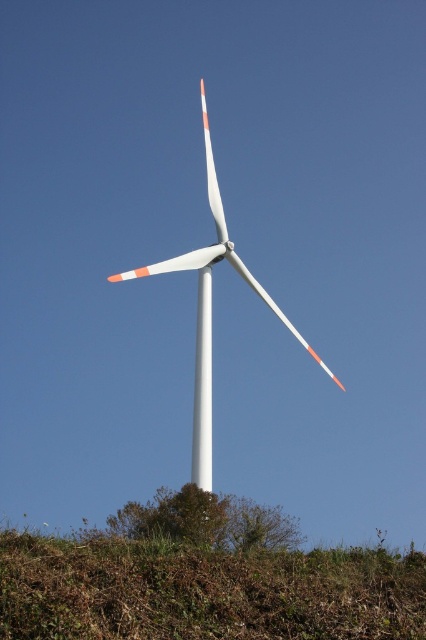
Question: Does green grassy at lower center lie in front of white matte windmill at center?

Choices:
 (A) yes
 (B) no

Answer: (A)

Question: Can you confirm if green grassy at lower center is positioned above white matte windmill at center?

Choices:
 (A) yes
 (B) no

Answer: (B)

Question: Can you confirm if green grassy at lower center is smaller than white matte windmill at center?

Choices:
 (A) no
 (B) yes

Answer: (B)

Question: Which object appears closest to the camera in this image?

Choices:
 (A) green grassy at lower center
 (B) white matte windmill at center

Answer: (A)